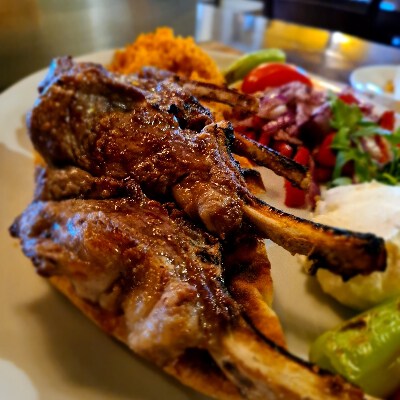
The height and width of the screenshot is (400, 400). I want to click on bowl, so click(x=372, y=90).